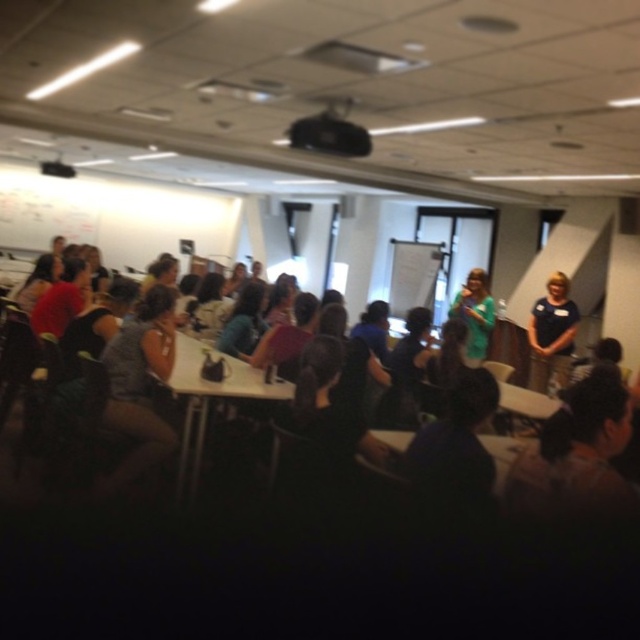
Question: Can you confirm if matte black table at center is smaller than green fabric dress at center?

Choices:
 (A) no
 (B) yes

Answer: (A)

Question: Is blue fabric shirt at center bigger than white paperboard at center?

Choices:
 (A) no
 (B) yes

Answer: (A)

Question: Which is nearer to the white paperboard at center?

Choices:
 (A) matte black table at center
 (B) blue fabric shirt at center
 (C) black plastic projector at upper center

Answer: (B)

Question: Which point is farther from the camera taking this photo?

Choices:
 (A) (179, 339)
 (B) (417, 269)
 (C) (552, 300)

Answer: (B)

Question: Does black plastic projector at upper center have a smaller size compared to green fabric dress at center?

Choices:
 (A) yes
 (B) no

Answer: (A)

Question: Which is nearer to the matte black table at center?

Choices:
 (A) black plastic projector at upper center
 (B) white paperboard at center
 (C) green fabric dress at center

Answer: (A)